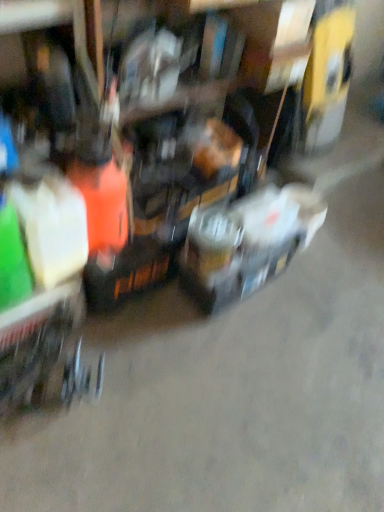
Question: Is metallic silver trolley at lower left outside metallic silver toolbox at center?

Choices:
 (A) no
 (B) yes

Answer: (B)

Question: Is metallic silver trolley at lower left in contact with metallic silver toolbox at center?

Choices:
 (A) no
 (B) yes

Answer: (A)

Question: Does metallic silver trolley at lower left have a lesser height compared to metallic silver toolbox at center?

Choices:
 (A) no
 (B) yes

Answer: (B)

Question: From a real-world perspective, is metallic silver trolley at lower left beneath metallic silver toolbox at center?

Choices:
 (A) no
 (B) yes

Answer: (B)

Question: Is metallic silver trolley at lower left to the right of metallic silver toolbox at center from the viewer's perspective?

Choices:
 (A) no
 (B) yes

Answer: (A)

Question: Is metallic silver trolley at lower left at the left side of metallic silver toolbox at center?

Choices:
 (A) no
 (B) yes

Answer: (B)

Question: Can you see metallic silver toolbox at center touching metallic silver trolley at lower left?

Choices:
 (A) yes
 (B) no

Answer: (B)

Question: From a real-world perspective, does metallic silver toolbox at center sit lower than metallic silver trolley at lower left?

Choices:
 (A) no
 (B) yes

Answer: (A)

Question: Considering the relative sizes of metallic silver toolbox at center and metallic silver trolley at lower left in the image provided, is metallic silver toolbox at center bigger than metallic silver trolley at lower left?

Choices:
 (A) yes
 (B) no

Answer: (A)

Question: Would you say metallic silver toolbox at center is outside metallic silver trolley at lower left?

Choices:
 (A) no
 (B) yes

Answer: (B)

Question: Can you confirm if metallic silver toolbox at center is smaller than metallic silver trolley at lower left?

Choices:
 (A) yes
 (B) no

Answer: (B)

Question: Is there a large distance between metallic silver toolbox at center and metallic silver trolley at lower left?

Choices:
 (A) yes
 (B) no

Answer: (B)

Question: From the image's perspective, relative to metallic silver trolley at lower left, is metallic silver toolbox at center above or below?

Choices:
 (A) below
 (B) above

Answer: (B)